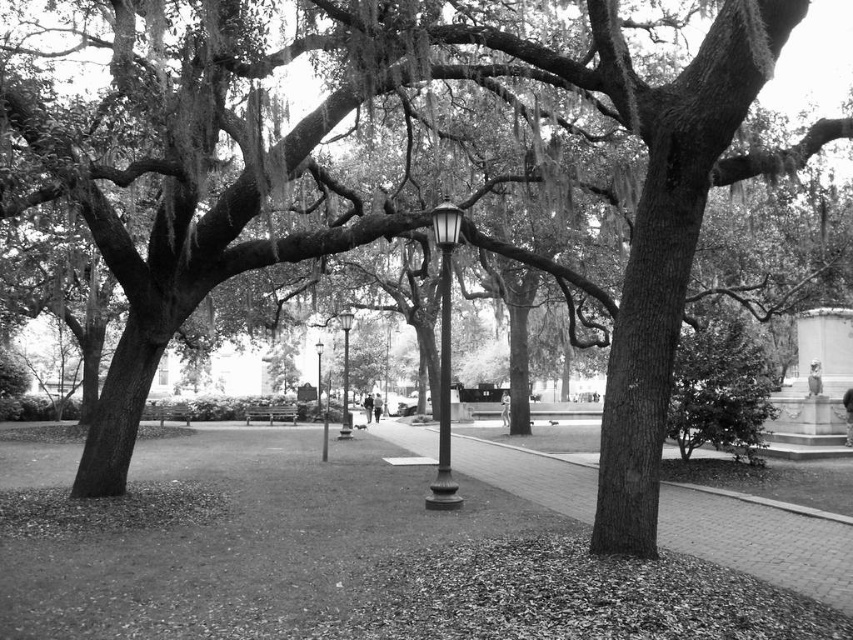
Question: Does polished metal lamp post at center have a lesser width compared to smooth metal lamp post at center?

Choices:
 (A) no
 (B) yes

Answer: (B)

Question: Which of the following is the farthest from the observer?

Choices:
 (A) (322, 348)
 (B) (262, 406)

Answer: (B)

Question: Among these objects, which one is nearest to the camera?

Choices:
 (A) wooden bench at center
 (B) polished metal lamp post at center

Answer: (B)

Question: From the image, what is the correct spatial relationship of polished metal lamp post at center in relation to metallic lamp post at center?

Choices:
 (A) below
 (B) above

Answer: (B)

Question: Which point is farther to the camera?

Choices:
 (A) click(x=669, y=522)
 (B) click(x=347, y=326)
 (C) click(x=445, y=360)

Answer: (B)

Question: Can you confirm if polished metal lamp post at center is positioned to the left of wooden bench at center?

Choices:
 (A) yes
 (B) no

Answer: (B)